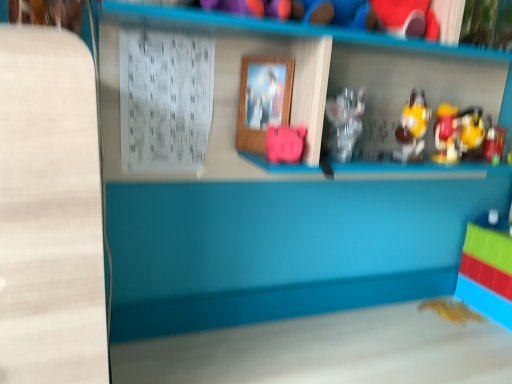
Locate an element on the screen. This screenshot has height=384, width=512. rubberized red plush toy at upper right, placed as the 5th toy when sorted from right to left is located at coordinates (407, 18).

Describe the element at coordinates (407, 18) in the screenshot. This screenshot has height=384, width=512. I see `rubberized red plush toy at upper right, arranged as the sixth toy when ordered from the bottom` at that location.

Locate an element on the screen. The width and height of the screenshot is (512, 384). yellow plastic toy at upper right, which is the fourth toy from right to left is located at coordinates (412, 128).

The height and width of the screenshot is (384, 512). I want to click on pink matte piggy bank at center, which appears as the 6th toy when viewed from the right, so click(x=284, y=143).

Measure the distance between point (436, 302) and camera.

Point (436, 302) and camera are 1.33 meters apart.

In order to click on wooden picture frame at center in this screenshot , I will do `click(263, 99)`.

In the scene shown: Can you confirm if translucent plastic toy at lower right, placed as the first toy when sorted from right to left, is thinner than gold metallic bat at lower right, marked as the 1th toy in a bottom-to-top arrangement?

In fact, translucent plastic toy at lower right, placed as the first toy when sorted from right to left, might be wider than gold metallic bat at lower right, marked as the 1th toy in a bottom-to-top arrangement.

How different are the orientations of translucent plastic toy at lower right, the second toy when ordered from bottom to top, and gold metallic bat at lower right, marked as the 1th toy in a bottom-to-top arrangement, in degrees?

translucent plastic toy at lower right, the second toy when ordered from bottom to top, and gold metallic bat at lower right, marked as the 1th toy in a bottom-to-top arrangement, are facing 0.002 degrees away from each other.

Would you say translucent plastic toy at lower right, positioned as the sixth toy in left-to-right order, is inside or outside gold metallic bat at lower right, which appears as the sixth toy when viewed from the top?

translucent plastic toy at lower right, positioned as the sixth toy in left-to-right order, lies outside gold metallic bat at lower right, which appears as the sixth toy when viewed from the top.

From a real-world perspective, between translucent plastic toy at lower right, the fifth toy from the top, and gold metallic bat at lower right, which ranks as the 4th toy in left-to-right order, who is vertically lower?

From a 3D spatial view, gold metallic bat at lower right, which ranks as the 4th toy in left-to-right order, is below.

Considering the positions of objects wooden picture frame at center and pink matte piggy bank at center, which ranks as the 1th toy in left-to-right order, in the image provided, who is more to the right, wooden picture frame at center or pink matte piggy bank at center, which ranks as the 1th toy in left-to-right order,?

pink matte piggy bank at center, which ranks as the 1th toy in left-to-right order, is more to the right.

You are a GUI agent. You are given a task and a screenshot of the screen. Output one action in this format:
    pyautogui.click(x=<x>, y=<y>)
    Task: Click on the 3rd toy below the wooden picture frame at center (from a real-world perspective)
    This screenshot has width=512, height=384.
    Given the screenshot: What is the action you would take?
    pyautogui.click(x=284, y=143)

Who is smaller, wooden picture frame at center or pink matte piggy bank at center, which is the third toy from bottom to top?

With smaller size is wooden picture frame at center.

Does point (271, 112) come farther from viewer compared to point (273, 151)?

Yes, it is behind point (273, 151).

Does metallic gold toy at right, acting as the second toy starting from the right, contain translucent plastic toy at lower right, the second toy when ordered from bottom to top?

No, translucent plastic toy at lower right, the second toy when ordered from bottom to top, is not a part of metallic gold toy at right, acting as the second toy starting from the right.

Considering the relative sizes of metallic gold toy at right, the third toy when ordered from top to bottom, and translucent plastic toy at lower right, positioned as the sixth toy in left-to-right order, in the image provided, is metallic gold toy at right, the third toy when ordered from top to bottom, smaller than translucent plastic toy at lower right, positioned as the sixth toy in left-to-right order,?

Correct, metallic gold toy at right, the third toy when ordered from top to bottom, occupies less space than translucent plastic toy at lower right, positioned as the sixth toy in left-to-right order.

Which is behind, metallic gold toy at right, acting as the second toy starting from the right, or translucent plastic toy at lower right, placed as the first toy when sorted from right to left?

translucent plastic toy at lower right, placed as the first toy when sorted from right to left, is behind.

Which is nearer, (x=500, y=127) or (x=486, y=245)?

Point (x=500, y=127).

Considering the sizes of objects rubberized red plush toy at upper right, placed as the 5th toy when sorted from right to left, and translucent plastic toy at lower right, positioned as the sixth toy in left-to-right order, in the image provided, who is taller, rubberized red plush toy at upper right, placed as the 5th toy when sorted from right to left, or translucent plastic toy at lower right, positioned as the sixth toy in left-to-right order,?

translucent plastic toy at lower right, positioned as the sixth toy in left-to-right order.

Which point is more distant from viewer, (423, 31) or (486, 287)?

The point (486, 287) is behind.

Is rubberized red plush toy at upper right, arranged as the sixth toy when ordered from the bottom, positioned beyond the bounds of translucent plastic toy at lower right, the second toy when ordered from bottom to top?

rubberized red plush toy at upper right, arranged as the sixth toy when ordered from the bottom, lies outside translucent plastic toy at lower right, the second toy when ordered from bottom to top,'s area.

From a real-world perspective, between yellow plastic toy at upper right, which is the 2th toy from top to bottom, and gold metallic bat at lower right, which appears as the sixth toy when viewed from the top, who is vertically lower?

gold metallic bat at lower right, which appears as the sixth toy when viewed from the top.

Considering the relative positions of yellow plastic toy at upper right, which is the 2th toy from top to bottom, and gold metallic bat at lower right, which ranks as the 4th toy in left-to-right order, in the image provided, is yellow plastic toy at upper right, which is the 2th toy from top to bottom, in front of gold metallic bat at lower right, which ranks as the 4th toy in left-to-right order,?

Yes, yellow plastic toy at upper right, which is the 2th toy from top to bottom, is closer to the camera.

Between yellow plastic toy at upper right, positioned as the 5th toy in bottom-to-top order, and gold metallic bat at lower right, marked as the 1th toy in a bottom-to-top arrangement, which one has more height?

With more height is yellow plastic toy at upper right, positioned as the 5th toy in bottom-to-top order.

I want to click on the 4th toy below the yellow plastic toy at upper right, positioned as the 5th toy in bottom-to-top order (from the image's perspective), so (x=451, y=311).

Is yellow plastic toy at upper right, which is the fourth toy from right to left, shorter than pink matte piggy bank at center, which is the third toy from bottom to top?

Incorrect, the height of yellow plastic toy at upper right, which is the fourth toy from right to left, does not fall short of that of pink matte piggy bank at center, which is the third toy from bottom to top.

From a real-world perspective, relative to pink matte piggy bank at center, which ranks as the 1th toy in left-to-right order, is yellow plastic toy at upper right, which is the 2th toy from top to bottom, vertically above or below?

Clearly, from a real-world perspective, yellow plastic toy at upper right, which is the 2th toy from top to bottom, is above pink matte piggy bank at center, which ranks as the 1th toy in left-to-right order.

Between yellow plastic toy at upper right, which is the 2th toy from top to bottom, and pink matte piggy bank at center, which is the third toy from bottom to top, which one has smaller size?

With smaller size is pink matte piggy bank at center, which is the third toy from bottom to top.

Can you tell me how much pink matte piggy bank at center, arranged as the fourth toy when viewed from the top, and wooden picture frame at center differ in facing direction?

There is a 37.9-degree angle between the facing directions of pink matte piggy bank at center, arranged as the fourth toy when viewed from the top, and wooden picture frame at center.

Considering the relative positions of pink matte piggy bank at center, which is the third toy from bottom to top, and wooden picture frame at center in the image provided, is pink matte piggy bank at center, which is the third toy from bottom to top, behind wooden picture frame at center?

No, pink matte piggy bank at center, which is the third toy from bottom to top, is closer to the viewer.

Would you say pink matte piggy bank at center, which is the third toy from bottom to top, contains wooden picture frame at center?

No, wooden picture frame at center is located outside of pink matte piggy bank at center, which is the third toy from bottom to top.

How distant is pink matte piggy bank at center, which ranks as the 1th toy in left-to-right order, from wooden picture frame at center?

The distance of pink matte piggy bank at center, which ranks as the 1th toy in left-to-right order, from wooden picture frame at center is 4.67 inches.

This screenshot has width=512, height=384. In order to click on toy behind the translucent plastic toy at lower right, positioned as the sixth toy in left-to-right order in this screenshot , I will do `click(451, 311)`.

Identify the location of the 1st toy counting from the right side of the wooden picture frame at center. (284, 143).

Considering their positions, is translucent plastic toy at lower right, the second toy when ordered from bottom to top, positioned further to rubberized red plush toy at upper right, placed as the 5th toy when sorted from right to left, than gold metallic bat at lower right, which is the 3th toy in right-to-left order?

gold metallic bat at lower right, which is the 3th toy in right-to-left order.

Which object lies further to the anchor point rubberized red plush toy at upper right, placed as the 5th toy when sorted from right to left, metallic gold toy at right, marked as the 4th toy in a bottom-to-top arrangement, or yellow plastic toy at upper right, which is the 2th toy from top to bottom?

metallic gold toy at right, marked as the 4th toy in a bottom-to-top arrangement, lies further to rubberized red plush toy at upper right, placed as the 5th toy when sorted from right to left, than the other object.

When comparing their distances from metallic gold toy at right, the third toy when ordered from top to bottom, does translucent plastic toy at lower right, placed as the first toy when sorted from right to left, or pink matte piggy bank at center, which is the third toy from bottom to top, seem closer?

The object closer to metallic gold toy at right, the third toy when ordered from top to bottom, is translucent plastic toy at lower right, placed as the first toy when sorted from right to left.

Estimate the real-world distances between objects in this image. Which object is further from yellow plastic toy at upper right, which is the fourth toy from right to left, metallic gold toy at right, positioned as the fifth toy in left-to-right order, or pink matte piggy bank at center, which ranks as the 1th toy in left-to-right order?

Based on the image, pink matte piggy bank at center, which ranks as the 1th toy in left-to-right order, appears to be further to yellow plastic toy at upper right, which is the fourth toy from right to left.

From the image, which object appears to be farther from gold metallic bat at lower right, which is the 3th toy in right-to-left order, pink matte piggy bank at center, which ranks as the 1th toy in left-to-right order, or wooden picture frame at center?

Among the two, wooden picture frame at center is located further to gold metallic bat at lower right, which is the 3th toy in right-to-left order.

From the picture: Estimate the real-world distances between objects in this image. Which object is further from pink matte piggy bank at center, arranged as the fourth toy when viewed from the top, rubberized red plush toy at upper right, placed as the 5th toy when sorted from right to left, or gold metallic bat at lower right, marked as the 1th toy in a bottom-to-top arrangement?

gold metallic bat at lower right, marked as the 1th toy in a bottom-to-top arrangement.

Based on the photo, based on their spatial positions, is gold metallic bat at lower right, marked as the 1th toy in a bottom-to-top arrangement, or pink matte piggy bank at center, which ranks as the 1th toy in left-to-right order, closer to rubberized red plush toy at upper right, placed as the 5th toy when sorted from right to left?

pink matte piggy bank at center, which ranks as the 1th toy in left-to-right order, lies closer to rubberized red plush toy at upper right, placed as the 5th toy when sorted from right to left, than the other object.

From the image, which object appears to be farther from yellow plastic toy at upper right, which is the fourth toy from right to left, wooden picture frame at center or translucent plastic toy at lower right, the fifth toy from the top?

The object further to yellow plastic toy at upper right, which is the fourth toy from right to left, is translucent plastic toy at lower right, the fifth toy from the top.

Where is `picture frame between rubberized red plush toy at upper right, arranged as the sixth toy when ordered from the bottom, and pink matte piggy bank at center, which is the third toy from bottom to top, in the up-down direction`? picture frame between rubberized red plush toy at upper right, arranged as the sixth toy when ordered from the bottom, and pink matte piggy bank at center, which is the third toy from bottom to top, in the up-down direction is located at coordinates (263, 99).

Where is `picture frame between rubberized red plush toy at upper right, which is the 2th toy in left-to-right order, and gold metallic bat at lower right, which appears as the sixth toy when viewed from the top, vertically`? This screenshot has height=384, width=512. picture frame between rubberized red plush toy at upper right, which is the 2th toy in left-to-right order, and gold metallic bat at lower right, which appears as the sixth toy when viewed from the top, vertically is located at coordinates (263, 99).